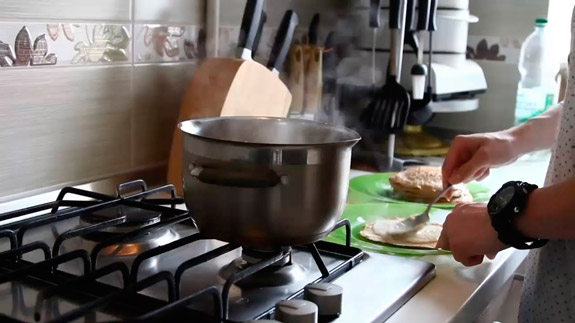
Where is `stove knobs`? This screenshot has height=323, width=575. stove knobs is located at coordinates (299, 308), (315, 293).